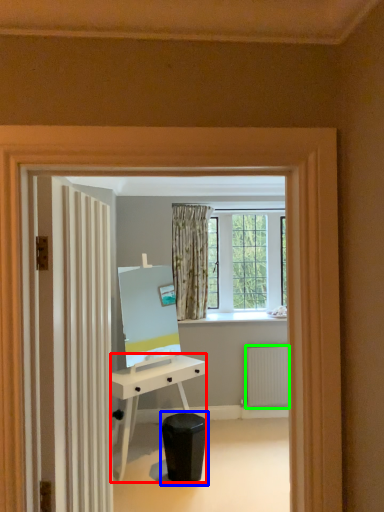
Question: Considering the real-world distances, which object is closest to desk (highlighted by a red box)? swivel chair (highlighted by a blue box) or radiator (highlighted by a green box).

Choices:
 (A) swivel chair
 (B) radiator

Answer: (A)